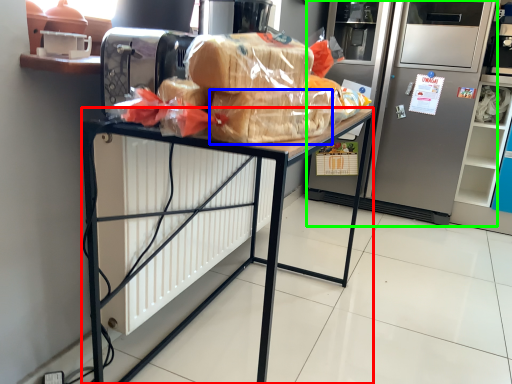
Question: Based on their relative distances, which object is nearer to desk (highlighted by a red box)? Choose from snack (highlighted by a blue box) and refrigerator (highlighted by a green box).

Choices:
 (A) snack
 (B) refrigerator

Answer: (A)